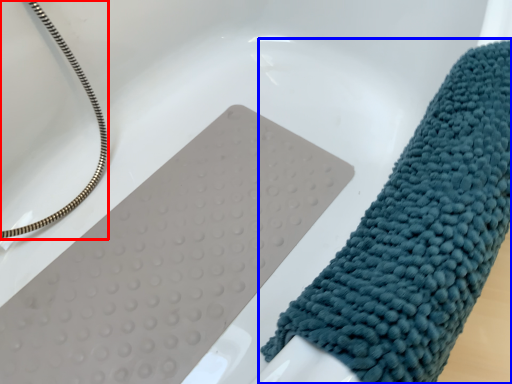
Question: Which of the following is the closest to the observer, rope (highlighted by a red box) or towel (highlighted by a blue box)?

Choices:
 (A) rope
 (B) towel

Answer: (B)